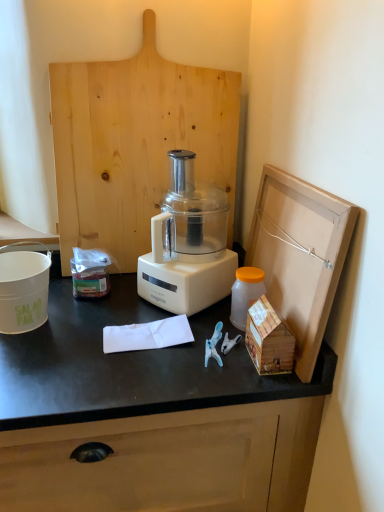
Question: Is natural wood cutting board at center, which appears as the first wood when viewed from the left, taller or shorter than white matte salad pail at left?

Choices:
 (A) short
 (B) tall

Answer: (B)

Question: From a real-world perspective, is natural wood cutting board at center, the 2th wood in the right-to-left sequence, above or below white matte salad pail at left?

Choices:
 (A) below
 (B) above

Answer: (B)

Question: Based on their relative distances, which object is farther from the natural wood cutting board at center, which appears as the first wood when viewed from the left?

Choices:
 (A) wooden house at right, marked as the first wood in a right-to-left arrangement
 (B) translucent plastic container at center-left
 (C) white plastic blender at center
 (D) white matte salad pail at left
 (E) translucent plastic bottle at right

Answer: (A)

Question: Estimate the real-world distances between objects in this image. Which object is closer to the white plastic blender at center?

Choices:
 (A) wooden house at right, which is the 1th wood in bottom-to-top order
 (B) translucent plastic container at center-left
 (C) translucent plastic bottle at right
 (D) white matte salad pail at left
 (E) natural wood cutting board at center, which is counted as the 1th wood, starting from the back

Answer: (C)